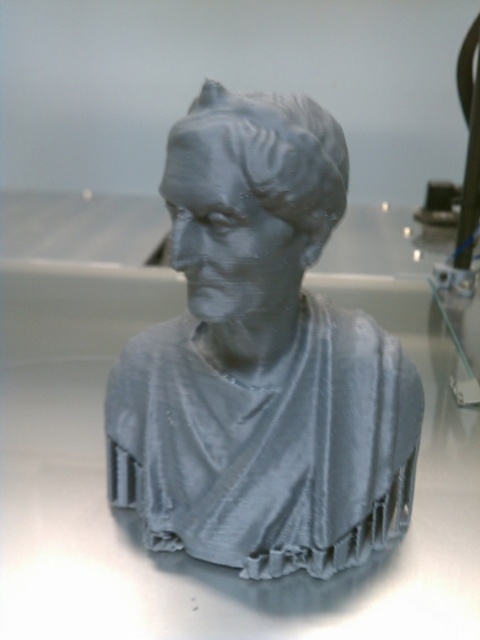
Wait, the two object labels are identical except for the first word. Is there a typo here? The user might have intended to have two different objects but repeated the same label. Let me check the problem again. The user provided the Objects as gray matte bust at center and matte gray bust at center. The difference is the first word being

The gray matte bust at center is below the matte gray bust at center. However, both objects are described as being at the center, which might be a labeling error. Please verify the object labels for accuracy.

You are an art student analyzing the composition of a 3d printed bust. You notice two objects labeled as gray matte bust at center and matte gray bust at center in the scene. Which one is closer to you?

The gray matte bust at center is closer to you because the matte gray bust at center is positioned behind it according to the description.

You are an art student analyzing the image of a classical bust. You notice two objects labeled as gray matte bust at center and matte gray bust at center. Since they are both at the center, how can you distinguish which one is larger?

The gray matte bust at center is larger in size than the matte gray bust at center, so you can tell the larger one by its bigger dimensions compared to the other.